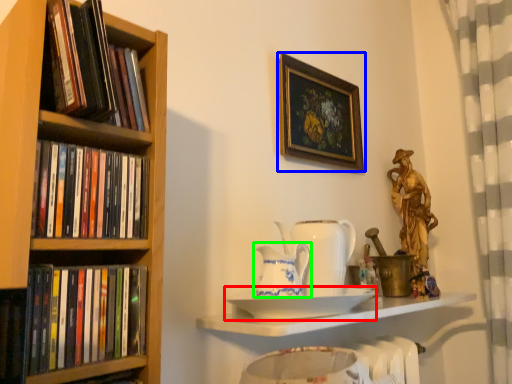
Question: Estimate the real-world distances between objects in this image. Which object is closer to plate (highlighted by a red box), picture frame (highlighted by a blue box) or tea pot (highlighted by a green box)?

Choices:
 (A) picture frame
 (B) tea pot

Answer: (B)